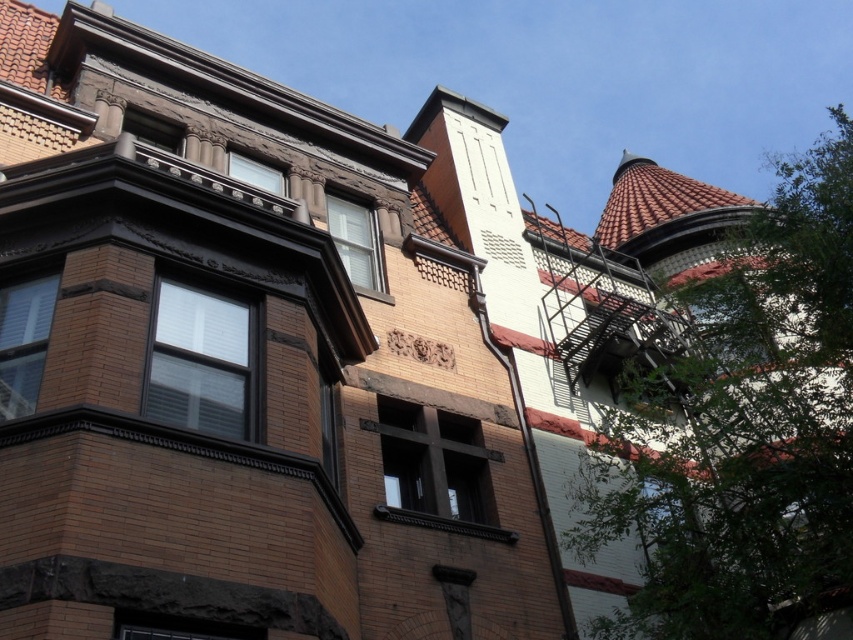
You are standing in front of a residential building and notice two windows. One is the brown brick window at center and the other is the matte brown window at upper center. Which window is located higher up on the building?

The matte brown window at upper center is located higher up on the building than the brown brick window at center.